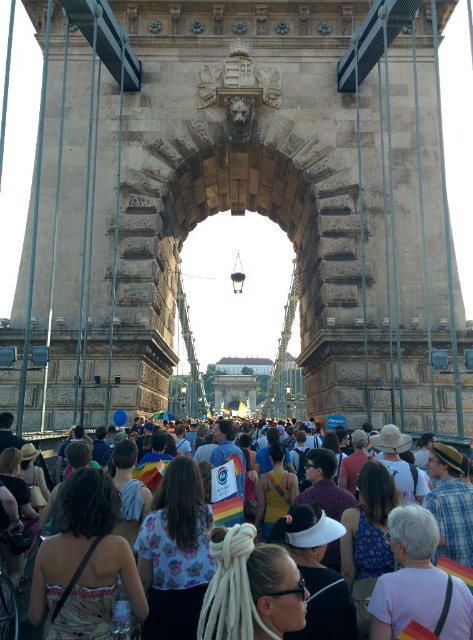
Who is positioned more to the right, white dreadlocks at center or plaid fabric shirt at center-right?

Positioned to the right is plaid fabric shirt at center-right.

Based on the photo, is white dreadlocks at center smaller than plaid fabric shirt at center-right?

Correct, white dreadlocks at center occupies less space than plaid fabric shirt at center-right.

Locate an element on the screen. white dreadlocks at center is located at coordinates (x=251, y=588).

The height and width of the screenshot is (640, 473). Identify the location of white dreadlocks at center. (251, 588).

Does printed fabric dress at center have a smaller size compared to floral fabric shirt at center?

Incorrect, printed fabric dress at center is not smaller in size than floral fabric shirt at center.

Does point (67, 563) come farther from viewer compared to point (207, 564)?

No, (67, 563) is closer to viewer.

Is point (110, 524) farther from viewer compared to point (190, 545)?

No.

The width and height of the screenshot is (473, 640). Identify the location of printed fabric dress at center. (84, 563).

Between printed fabric dress at center and yellow fabric bag at center, which one appears on the right side from the viewer's perspective?

Positioned to the right is yellow fabric bag at center.

Consider the image. How distant is printed fabric dress at center from yellow fabric bag at center?

A distance of 61.14 feet exists between printed fabric dress at center and yellow fabric bag at center.

I want to click on printed fabric dress at center, so click(x=84, y=563).

Identify the location of printed fabric dress at center. (84, 563).